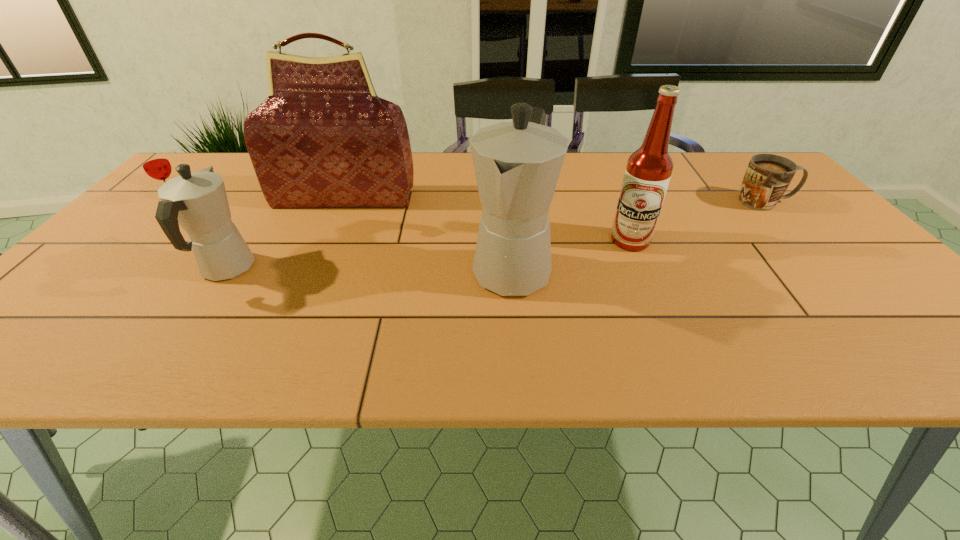
All coffeepots are currently evenly spaced. To continue this pattern, where would you add another coffeepot on the right? Please point out a vacant spot. Please provide its 2D coordinates. Your answer should be formatted as a tuple, i.e. [(x, y)], where the tuple contains the x and y coordinates of a point satisfying the conditions above.

[(795, 267)]